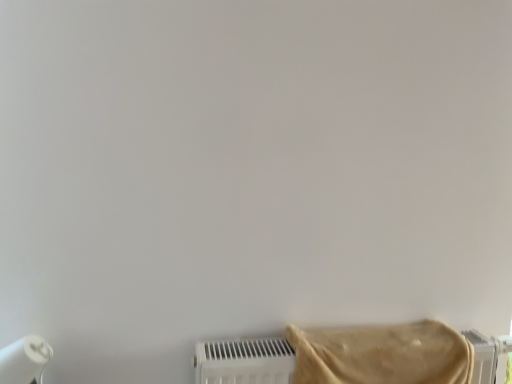
What is the approximate height of beige fabric towel at lower right?

It is 8.44 inches.

You are a GUI agent. You are given a task and a screenshot of the screen. Output one action in this format:
    pyautogui.click(x=<x>, y=<y>)
    Task: Click on the beige fabric towel at lower right
    Image resolution: width=512 pixels, height=384 pixels.
    Given the screenshot: What is the action you would take?
    pyautogui.click(x=381, y=354)

Based on the photo, what is the approximate width of beige fabric towel at lower right?

13.95 inches.

Measure the distance between point (398, 339) and camera.

Point (398, 339) and camera are 3.74 feet apart from each other.

Describe the element at coordinates (381, 354) in the screenshot. I see `beige fabric towel at lower right` at that location.

I want to click on white matte paper towel at lower left, so click(x=24, y=360).

Describe the element at coordinates (24, 360) in the screenshot. The image size is (512, 384). I see `white matte paper towel at lower left` at that location.

Locate an element on the screen. beige fabric towel at lower right is located at coordinates (381, 354).

Between beige fabric towel at lower right and white matte paper towel at lower left, which one appears on the right side from the viewer's perspective?

beige fabric towel at lower right.

Is beige fabric towel at lower right in front of or behind white matte paper towel at lower left in the image?

In the image, beige fabric towel at lower right appears in front of white matte paper towel at lower left.

In the scene shown: Which point is more distant from viewer, (433, 371) or (39, 337)?

The point (433, 371) is more distant.

Looking at this image, from the image's perspective, between beige fabric towel at lower right and white matte paper towel at lower left, who is located below?

From the image's view, white matte paper towel at lower left is below.

From a real-world perspective, is beige fabric towel at lower right below white matte paper towel at lower left?

Incorrect, from a real-world perspective, beige fabric towel at lower right is higher than white matte paper towel at lower left.

Considering the sizes of objects beige fabric towel at lower right and white matte paper towel at lower left in the image provided, who is thinner, beige fabric towel at lower right or white matte paper towel at lower left?

white matte paper towel at lower left.

Does beige fabric towel at lower right have a greater height compared to white matte paper towel at lower left?

Incorrect, the height of beige fabric towel at lower right is not larger of that of white matte paper towel at lower left.

Can you confirm if beige fabric towel at lower right is bigger than white matte paper towel at lower left?

Indeed, beige fabric towel at lower right has a larger size compared to white matte paper towel at lower left.

Is beige fabric towel at lower right inside the boundaries of white matte paper towel at lower left, or outside?

The correct answer is: outside.

Are beige fabric towel at lower right and white matte paper towel at lower left located far from each other?

beige fabric towel at lower right is near white matte paper towel at lower left, not far away.

Is beige fabric towel at lower right looking in the opposite direction of white matte paper towel at lower left?

beige fabric towel at lower right is not turned away from white matte paper towel at lower left.

Can you tell me how much beige fabric towel at lower right and white matte paper towel at lower left differ in facing direction?

0.404 degrees.

How far apart are beige fabric towel at lower right and white matte paper towel at lower left?

77.24 centimeters.

The image size is (512, 384). What are the coordinates of `towel to the right of white matte paper towel at lower left` in the screenshot? It's located at (381, 354).

From the picture: Can you confirm if white matte paper towel at lower left is positioned to the right of beige fabric towel at lower right?

A: No.

Is white matte paper towel at lower left in front of or behind beige fabric towel at lower right in the image?

white matte paper towel at lower left is behind beige fabric towel at lower right.

Is point (39, 366) positioned behind point (416, 353)?

No, (39, 366) is in front of (416, 353).

From the image's perspective, which one is positioned lower, white matte paper towel at lower left or beige fabric towel at lower right?

white matte paper towel at lower left appears lower in the image.

From a real-world perspective, relative to beige fabric towel at lower right, is white matte paper towel at lower left vertically above or below?

white matte paper towel at lower left is situated lower than beige fabric towel at lower right in the real world.

Can you confirm if white matte paper towel at lower left is wider than beige fabric towel at lower right?

In fact, white matte paper towel at lower left might be narrower than beige fabric towel at lower right.

In terms of height, does white matte paper towel at lower left look taller or shorter compared to beige fabric towel at lower right?

white matte paper towel at lower left is taller than beige fabric towel at lower right.

Considering the relative sizes of white matte paper towel at lower left and beige fabric towel at lower right in the image provided, is white matte paper towel at lower left bigger than beige fabric towel at lower right?

No.

Can beige fabric towel at lower right be found inside white matte paper towel at lower left?

No, white matte paper towel at lower left does not contain beige fabric towel at lower right.

Is white matte paper towel at lower left not near beige fabric towel at lower right?

No, white matte paper towel at lower left is not far away from beige fabric towel at lower right.

Is white matte paper towel at lower left looking in the opposite direction of beige fabric towel at lower right?

That's not correct — white matte paper towel at lower left is not looking away from beige fabric towel at lower right.

How different are the orientations of white matte paper towel at lower left and beige fabric towel at lower right in degrees?

white matte paper towel at lower left and beige fabric towel at lower right are facing 0.404 degrees away from each other.

Measure the distance between white matte paper towel at lower left and beige fabric towel at lower right.

white matte paper towel at lower left is 30.41 inches away from beige fabric towel at lower right.

What are the coordinates of `paper towel lying behind the beige fabric towel at lower right` in the screenshot? It's located at (24, 360).

Where is `towel above the white matte paper towel at lower left (from a real-world perspective)`? towel above the white matte paper towel at lower left (from a real-world perspective) is located at coordinates (381, 354).

Where is `paper towel that is behind the beige fabric towel at lower right`? paper towel that is behind the beige fabric towel at lower right is located at coordinates (24, 360).